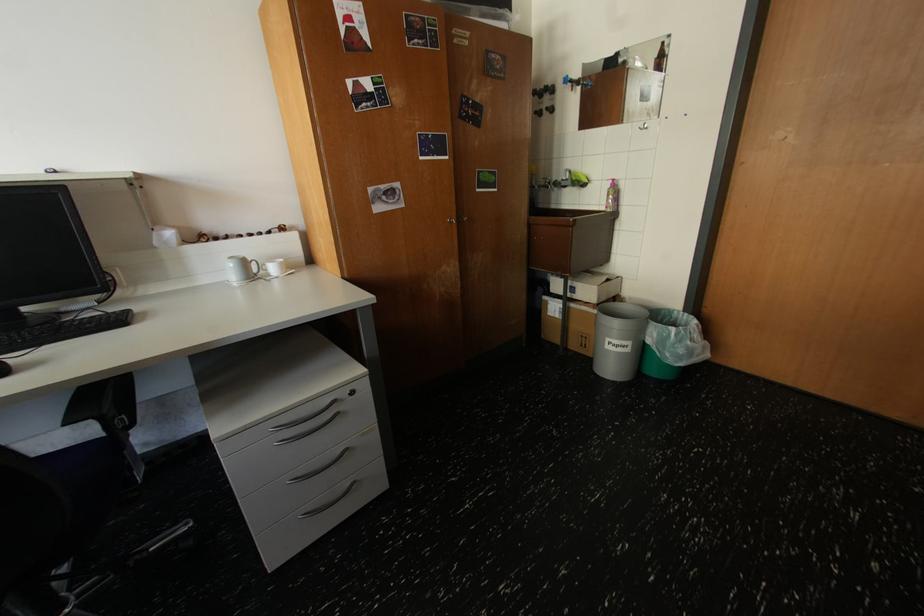
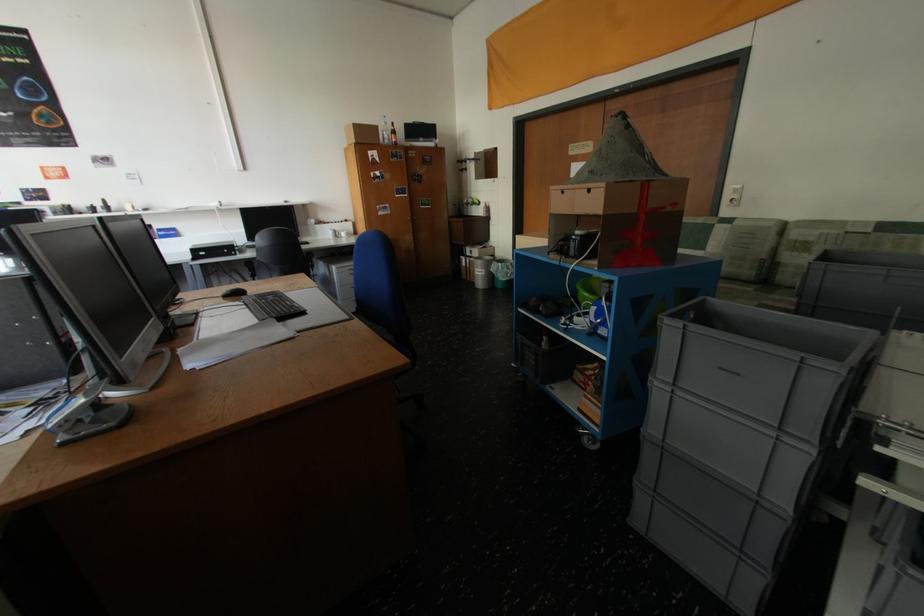
The point at (616, 341) is marked in the first image. Where is the corresponding point in the second image?

(484, 270)